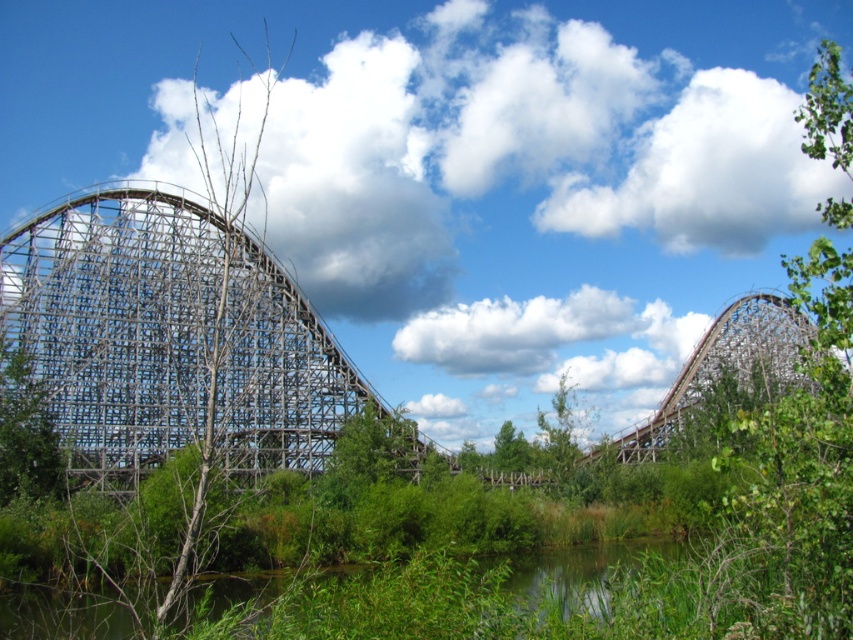
You are standing at the point with coordinates point (583, 572) in the roller coaster scene. What do you see directly below you?

The point (583, 572) corresponds to the green grassy river at lower center, so you would see the green grassy river at lower center directly below you.